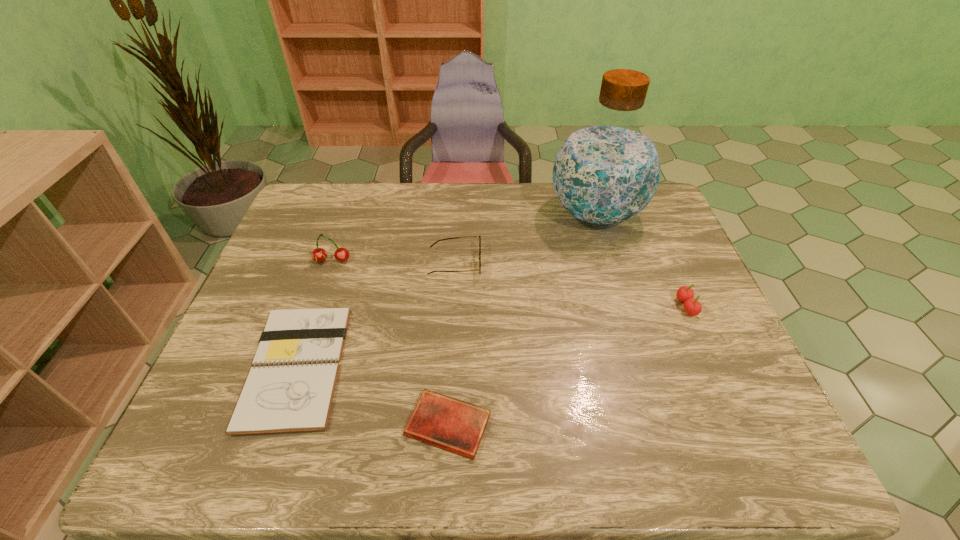
Find the location of a particular element. This screenshot has height=540, width=960. blank region between the diary and the shorter cherry is located at coordinates (566, 366).

Find the location of a particular element. unoccupied position between the diary and the water jug is located at coordinates (522, 320).

Locate an element on the screen. This screenshot has width=960, height=540. vacant area between the tallest object and the shortest object is located at coordinates (522, 320).

Identify the location of free spot between the diary and the notepad. (372, 395).

Find the location of `vacant region between the fifth shortest object and the third tallest object`. vacant region between the fifth shortest object and the third tallest object is located at coordinates (509, 284).

Find the location of `vacant area between the water jug and the second shortest object`. vacant area between the water jug and the second shortest object is located at coordinates (446, 291).

The image size is (960, 540). What are the coordinates of `vacant area between the water jug and the third shortest object` in the screenshot? It's located at (525, 239).

Identify the location of the fourth closest object to the farther cherry. The width and height of the screenshot is (960, 540). [x=606, y=172].

Select which object is the fourth closest to the notepad. Please provide its 2D coordinates. Your answer should be formatted as a tuple, i.e. [(x, y)], where the tuple contains the x and y coordinates of a point satisfying the conditions above.

[(606, 172)]

Locate an element on the screen. This screenshot has width=960, height=540. vacant region that satisfies the following two spatial constraints: 1. on the face of the fourth tallest object; 2. on the left side of the shorter cherry is located at coordinates (452, 307).